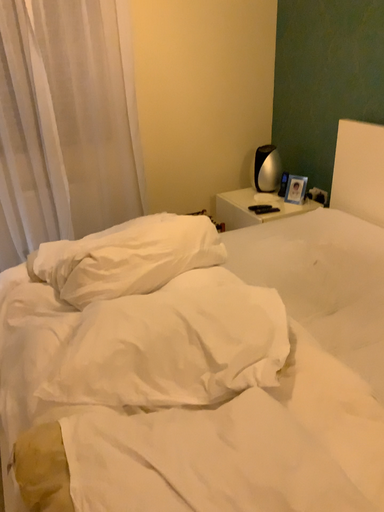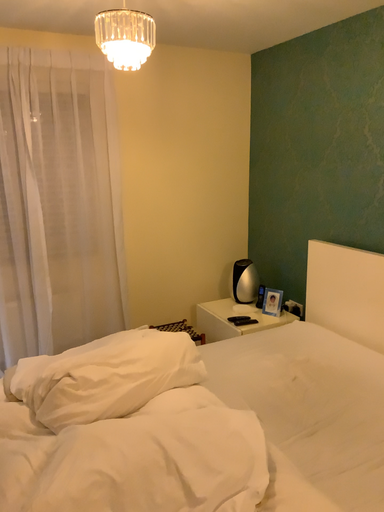
Question: Which way did the camera rotate in the video?

Choices:
 (A) rotated upward
 (B) rotated downward

Answer: (A)